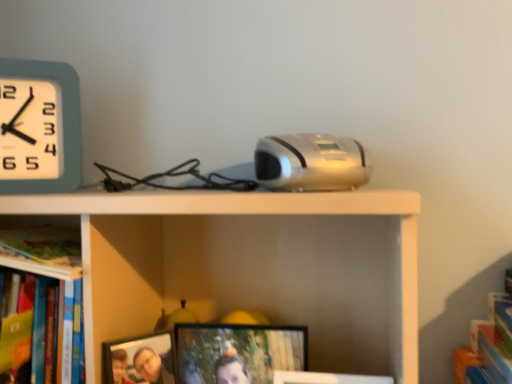
Question: Considering the positions of teal plastic wall clock at upper left and wooden photo frame at lower center, which is the 2th picture frame in right-to-left order, in the image, is teal plastic wall clock at upper left wider or thinner than wooden photo frame at lower center, which is the 2th picture frame in right-to-left order,?

Choices:
 (A) thin
 (B) wide

Answer: (A)

Question: Considering their positions, is teal plastic wall clock at upper left located in front of or behind wooden photo frame at lower center, which is the 2th picture frame in right-to-left order?

Choices:
 (A) behind
 (B) front

Answer: (A)

Question: Which of these objects is positioned closest to the matte black picture frame at center, which ranks as the first picture frame in right-to-left order?

Choices:
 (A) wooden photo frame at lower center, which is the 2th picture frame in right-to-left order
 (B) silver metallic projector at center
 (C) teal plastic wall clock at upper left

Answer: (A)

Question: Which is farther from the teal plastic wall clock at upper left?

Choices:
 (A) silver metallic projector at center
 (B) matte black picture frame at center, the 2th picture frame viewed from the left
 (C) wooden photo frame at lower center, which is the 2th picture frame in right-to-left order

Answer: (B)